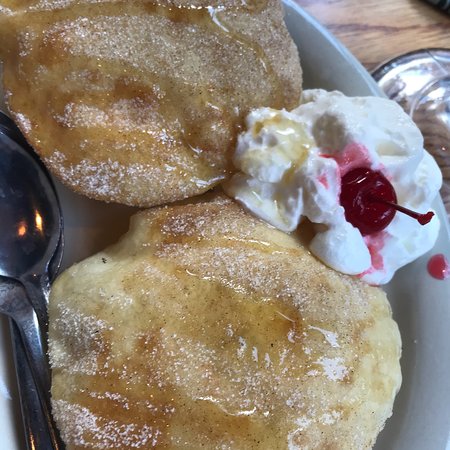
I want to click on table surface, so click(x=400, y=35).